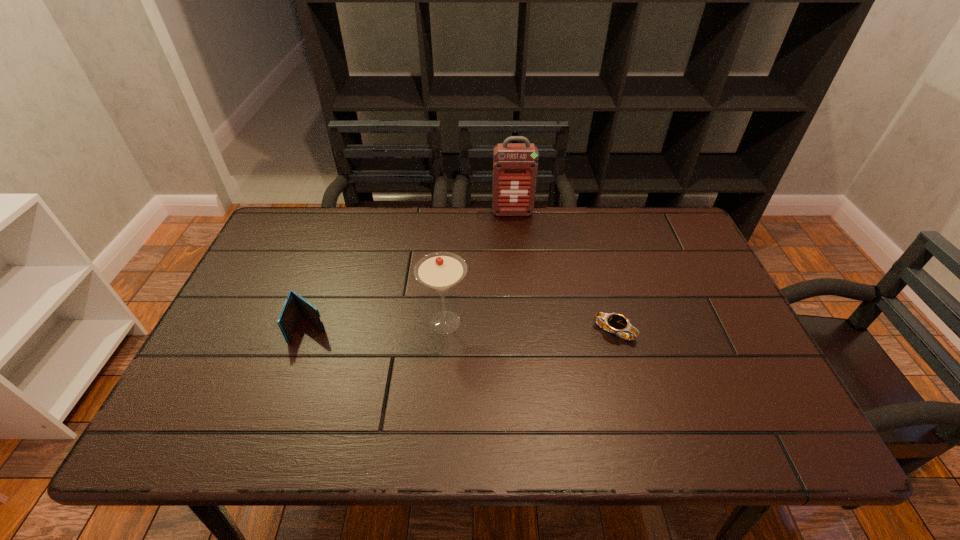
Point out which object is positioned as the second nearest to the shortest object. Please provide its 2D coordinates. Your answer should be formatted as a tuple, i.e. [(x, y)], where the tuple contains the x and y coordinates of a point satisfying the conditions above.

[(515, 166)]

Locate an element on the screen. This screenshot has width=960, height=540. vacant area that satisfies the following two spatial constraints: 1. on the exterior surface of the wallet; 2. on the right side of the shortest object is located at coordinates (309, 332).

The image size is (960, 540). What are the coordinates of `vacant region that satisfies the following two spatial constraints: 1. on the exterior surface of the second shortest object; 2. on the right side of the shortest object` in the screenshot? It's located at (309, 332).

Locate an element on the screen. This screenshot has width=960, height=540. vacant region that satisfies the following two spatial constraints: 1. on the front-facing side of the rightmost object; 2. on the right side of the first-aid kit is located at coordinates (523, 332).